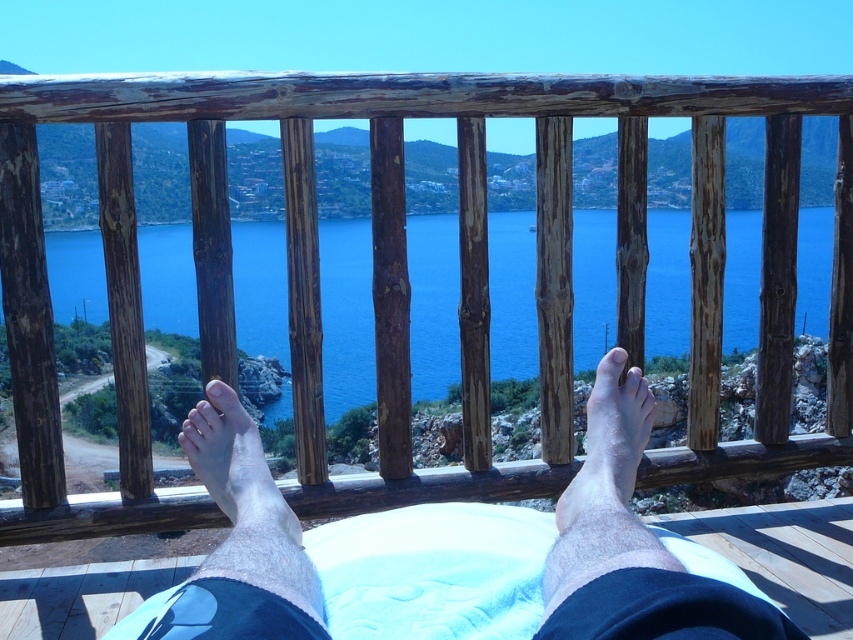
Question: Is brown wooden railing at center above pale skin at center?

Choices:
 (A) no
 (B) yes

Answer: (B)

Question: Is skinny white towel at lower center bigger than pale skin at center?

Choices:
 (A) no
 (B) yes

Answer: (B)

Question: Is blue water at center to the left of matte skin toe at center from the viewer's perspective?

Choices:
 (A) no
 (B) yes

Answer: (B)

Question: Which of the following is the closest to the observer?

Choices:
 (A) (651, 394)
 (B) (624, 365)
 (C) (91, 276)

Answer: (A)

Question: Which object appears closest to the camera in this image?

Choices:
 (A) white fabric at center
 (B) pale skin at lower center
 (C) brown wooden railing at center

Answer: (B)

Question: Based on their relative distances, which object is nearer to the matte skin toe at center?

Choices:
 (A) skinny white towel at lower center
 (B) blue water at center

Answer: (A)